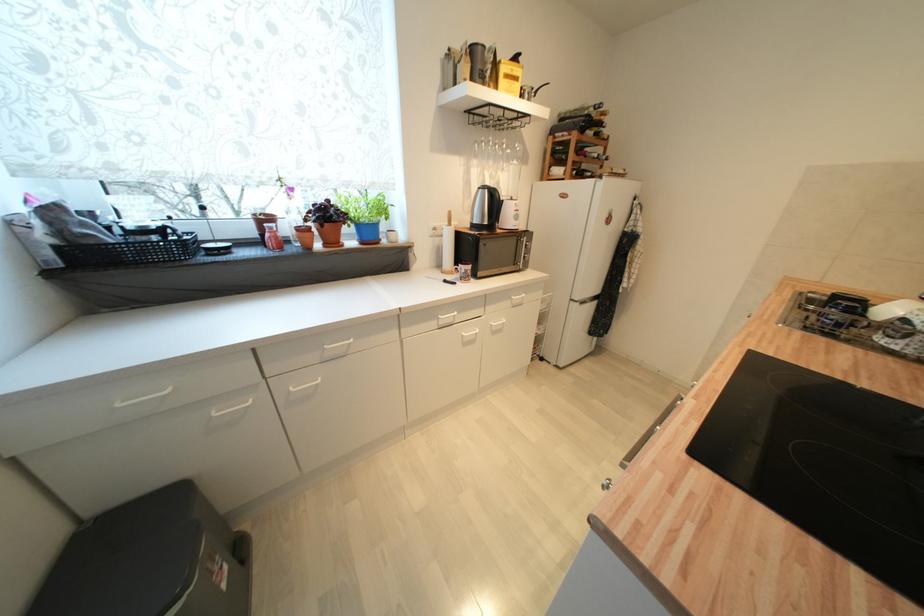
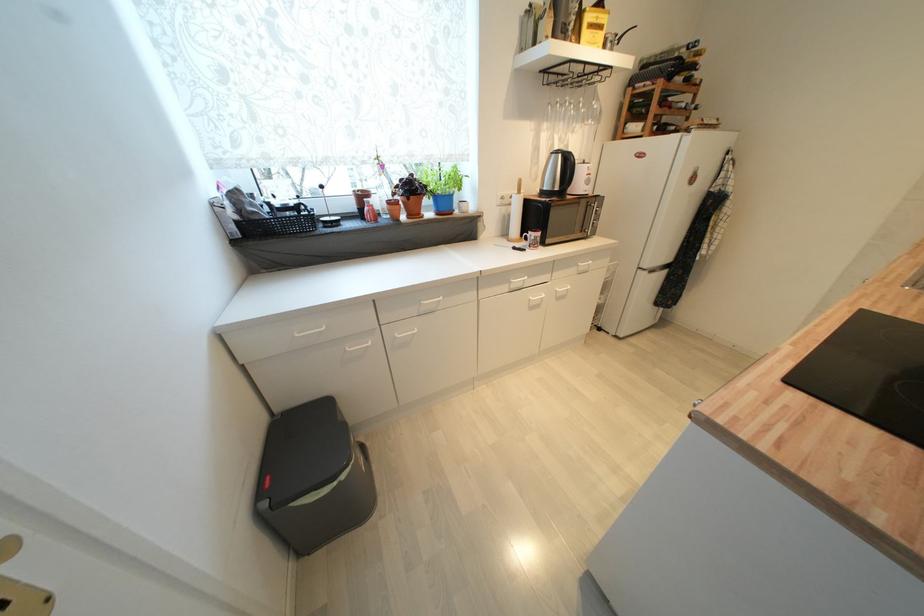
In the second image, find the point that corresponds to (x=581, y=161) in the first image.

(664, 114)